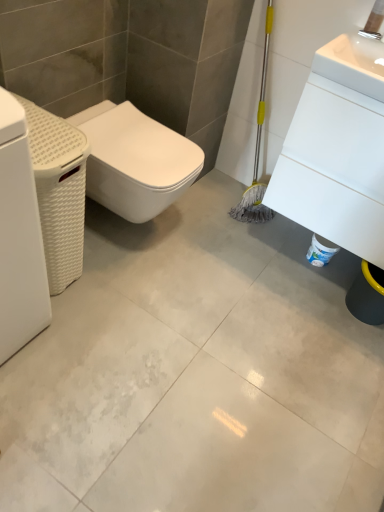
Question: Is point (74, 186) closer or farther from the camera than point (109, 154)?

Choices:
 (A) farther
 (B) closer

Answer: (B)

Question: Considering the positions of white woven basket at left, placed as the 2th porcelain when sorted from right to left, and white matte bidet at left in the image, is white woven basket at left, placed as the 2th porcelain when sorted from right to left, bigger or smaller than white matte bidet at left?

Choices:
 (A) small
 (B) big

Answer: (B)

Question: Estimate the real-world distances between objects in this image. Which object is closer to the white glossy concrete at center?

Choices:
 (A) white woven basket at left, placed as the 2th porcelain when sorted from right to left
 (B) white glossy sink at upper right, the 2th porcelain positioned from the left
 (C) white matte bidet at left
 (D) white matte washing machine at left

Answer: (C)

Question: Based on their relative distances, which object is nearer to the white matte bidet at left?

Choices:
 (A) white matte washing machine at left
 (B) white glossy concrete at center
 (C) white woven basket at left, the first porcelain viewed from the left
 (D) white glossy sink at upper right, the 2th porcelain positioned from the left

Answer: (C)